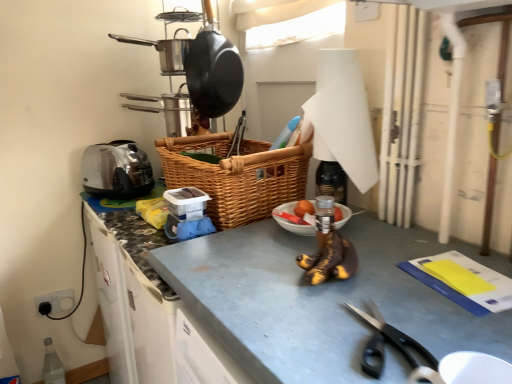
The height and width of the screenshot is (384, 512). Identify the location of vacant space to the left of black plastic scissors at lower right. (284, 326).